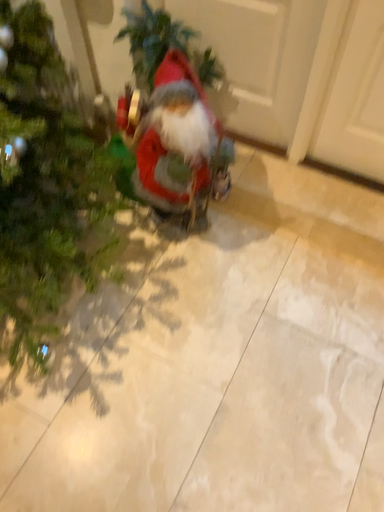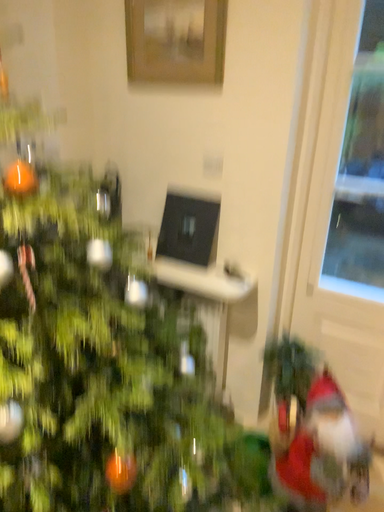
Question: Which way did the camera rotate in the video?

Choices:
 (A) rotated upward
 (B) rotated downward

Answer: (A)